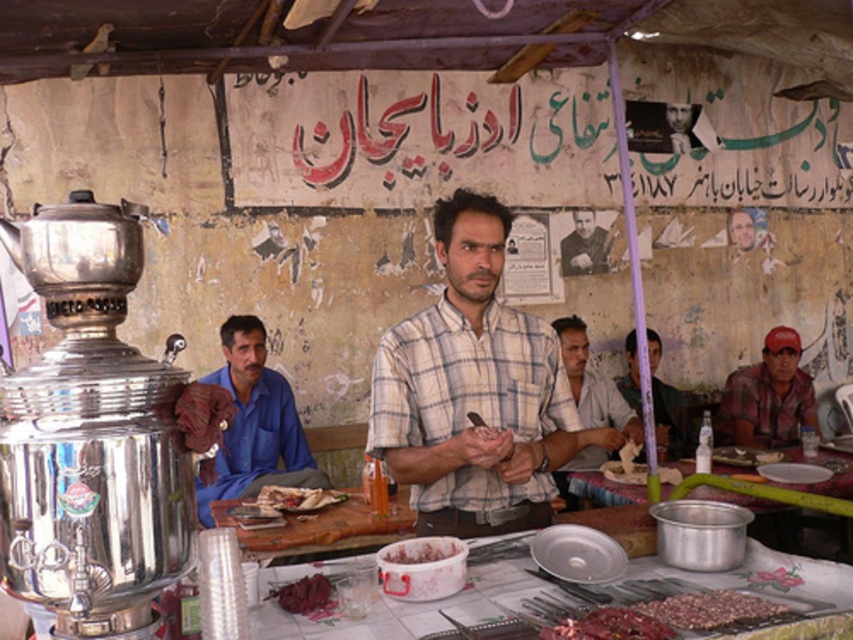
Looking at this image, you are a customer at the food stall and want to place your light brown fabric shirt at center on top of the dark red meat skewer at center. Will the shirt fit over the skewer?

The light brown fabric shirt at center might be wider than dark red meat skewer at center, so there is a possibility that the shirt could fit over the skewer, but it depends on the exact dimensions.

Consider the image. You are a customer in this dining area and you want to grab the metallic silver pot at center without touching the white checkered shirt at center. Is this possible?

The white checkered shirt at center is positioned on the left side of metallic silver pot at center, so you can reach the metallic silver pot at center from the right side without touching the white checkered shirt at center.